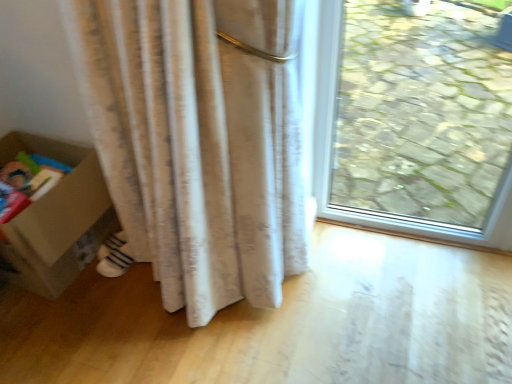
In order to face white striped socks at lower left, should I rotate leftwards or rightwards?

To align with it, rotate left about 17.296°.

Image resolution: width=512 pixels, height=384 pixels. What do you see at coordinates (114, 256) in the screenshot?
I see `white striped socks at lower left` at bounding box center [114, 256].

Identify the location of white striped socks at lower left. This screenshot has height=384, width=512. (114, 256).

What is the approximate height of cardboard box at lower left?

cardboard box at lower left is 17.64 inches tall.

This screenshot has width=512, height=384. I want to click on cardboard box at lower left, so click(x=57, y=219).

What do you see at coordinates (57, 219) in the screenshot? This screenshot has height=384, width=512. I see `cardboard box at lower left` at bounding box center [57, 219].

Locate an element on the screen. This screenshot has height=384, width=512. white striped socks at lower left is located at coordinates (114, 256).

Which is more to the right, cardboard box at lower left or white striped socks at lower left?

white striped socks at lower left.

Who is more distant, cardboard box at lower left or white striped socks at lower left?

white striped socks at lower left is further from the camera.

Is point (89, 199) positioned behind point (116, 257)?

No, it is in front of (116, 257).

From the image's perspective, would you say cardboard box at lower left is shown under white striped socks at lower left?

No, from the image's perspective, cardboard box at lower left is not beneath white striped socks at lower left.

From a real-world perspective, is cardboard box at lower left located higher than white striped socks at lower left?

Yes, from a real-world perspective, cardboard box at lower left is over white striped socks at lower left

Is cardboard box at lower left thinner than white striped socks at lower left?

In fact, cardboard box at lower left might be wider than white striped socks at lower left.

Considering the sizes of cardboard box at lower left and white striped socks at lower left in the image, is cardboard box at lower left taller or shorter than white striped socks at lower left?

Clearly, cardboard box at lower left is taller compared to white striped socks at lower left.

Considering the relative sizes of cardboard box at lower left and white striped socks at lower left in the image provided, is cardboard box at lower left smaller than white striped socks at lower left?

No.

Would you say cardboard box at lower left is outside white striped socks at lower left?

Absolutely, cardboard box at lower left is external to white striped socks at lower left.

Is cardboard box at lower left next to white striped socks at lower left?

No, cardboard box at lower left is not beside white striped socks at lower left.

Could you tell me if cardboard box at lower left is facing white striped socks at lower left?

No, cardboard box at lower left does not turn towards white striped socks at lower left.

This screenshot has width=512, height=384. In order to click on box in front of the white striped socks at lower left in this screenshot , I will do `click(57, 219)`.

Can you confirm if white striped socks at lower left is positioned to the left of cardboard box at lower left?

No.

Is white striped socks at lower left positioned behind cardboard box at lower left?

Yes, it is behind cardboard box at lower left.

Is point (108, 266) closer to viewer compared to point (72, 151)?

No.

From the image's perspective, does white striped socks at lower left appear lower than cardboard box at lower left?

Yes, from the image's perspective, white striped socks at lower left is below cardboard box at lower left.

From a real-world perspective, which object stands above the other?

From a 3D spatial view, cardboard box at lower left is above.

Which of these two, white striped socks at lower left or cardboard box at lower left, is wider?

cardboard box at lower left is wider.

Which of these two, white striped socks at lower left or cardboard box at lower left, stands taller?

Standing taller between the two is cardboard box at lower left.

Does white striped socks at lower left have a larger size compared to cardboard box at lower left?

Incorrect, white striped socks at lower left is not larger than cardboard box at lower left.

Is white striped socks at lower left completely or partially outside of cardboard box at lower left?

Yes, white striped socks at lower left is located beyond the bounds of cardboard box at lower left.

Is white striped socks at lower left far from cardboard box at lower left?

No, white striped socks at lower left is in close proximity to cardboard box at lower left.

Is white striped socks at lower left facing towards cardboard box at lower left?

No, white striped socks at lower left is not facing towards cardboard box at lower left.

Where is `box above the white striped socks at lower left (from a real-world perspective)`? This screenshot has width=512, height=384. box above the white striped socks at lower left (from a real-world perspective) is located at coordinates pyautogui.click(x=57, y=219).

Where is `box above the white striped socks at lower left (from a real-world perspective)`? This screenshot has height=384, width=512. box above the white striped socks at lower left (from a real-world perspective) is located at coordinates (57, 219).

This screenshot has height=384, width=512. In the image, there is a cardboard box at lower left. Find the location of `footwear below it (from the image's perspective)`. footwear below it (from the image's perspective) is located at coordinates [114, 256].